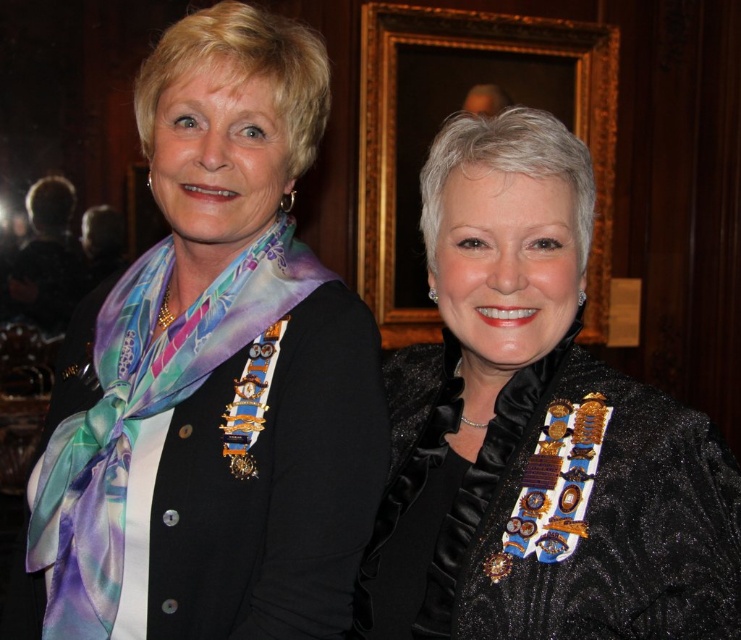
You are a photographer setting up for a formal event. You notice a black satin jacket at center and a wooden frame at upper center in the background. Which object should you adjust if you want to avoid the frame overlapping with the jacket in your shot?

The wooden frame at upper center is above the black satin jacket at center, so to avoid overlap, adjust the camera angle or position to lower the frame or raise the jacket in the composition.